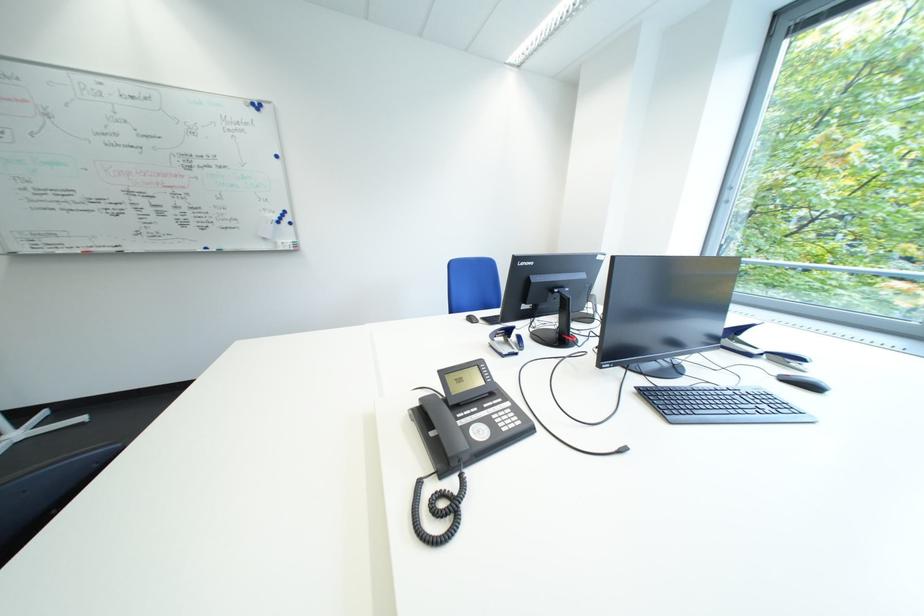
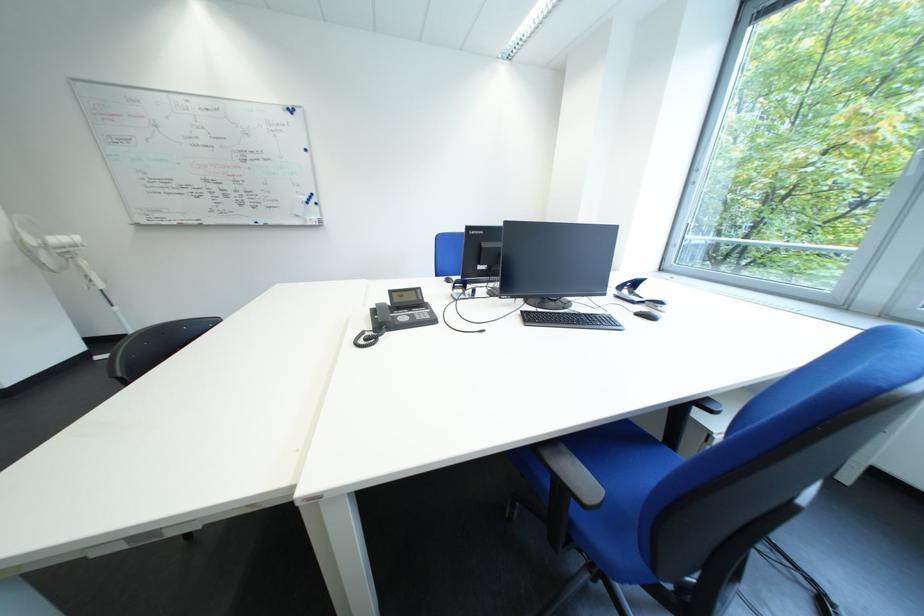
The point at (432, 402) is marked in the first image. Where is the corresponding point in the second image?

(388, 307)